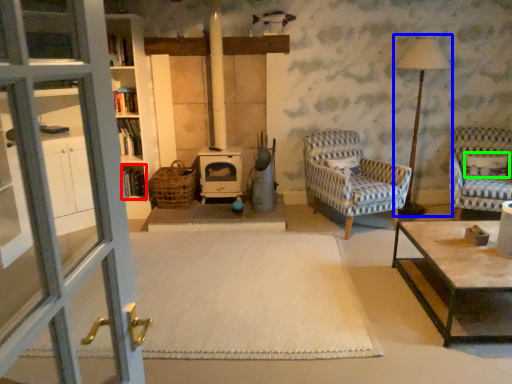
Question: Which object is positioned closest to shelf (highlighted by a red box)? Select from table lamp (highlighted by a blue box) and pillow (highlighted by a green box).

Choices:
 (A) table lamp
 (B) pillow

Answer: (A)